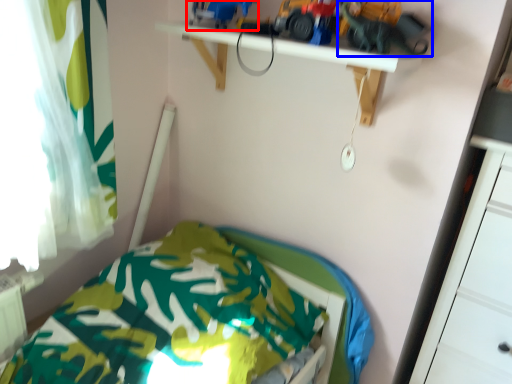
Question: Which point is closer to the camera, toy (highlighted by a red box) or toy car (highlighted by a blue box)?

Choices:
 (A) toy
 (B) toy car

Answer: (B)